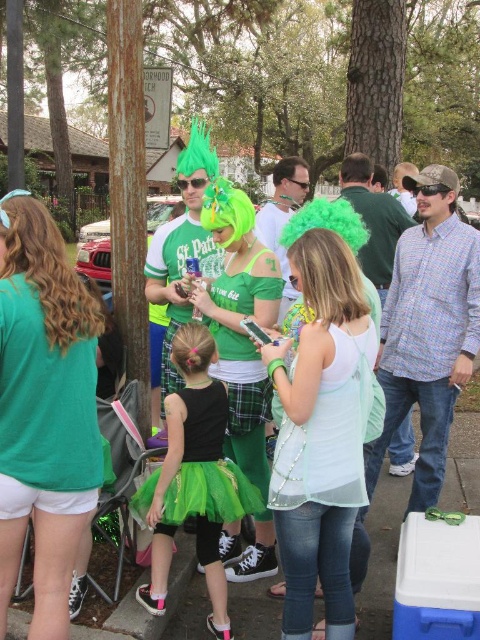
Is green tulle tutu at center behind matte green t-shirt at left?

Yes, green tulle tutu at center is further from the viewer.

Can you confirm if green tulle tutu at center is bigger than matte green t-shirt at left?

Yes.

What do you see at coordinates (193, 477) in the screenshot? I see `green tulle tutu at center` at bounding box center [193, 477].

Where is `green tulle tutu at center`? Image resolution: width=480 pixels, height=640 pixels. green tulle tutu at center is located at coordinates (193, 477).

Does green tulle tutu at center appear on the left side of mint sheer dress at center?

Yes, green tulle tutu at center is to the left of mint sheer dress at center.

Which is below, green tulle tutu at center or mint sheer dress at center?

green tulle tutu at center

Find the location of a particular element. The height and width of the screenshot is (640, 480). green tulle tutu at center is located at coordinates (193, 477).

Find the location of `green tulle tutu at center`. green tulle tutu at center is located at coordinates (193, 477).

Is light green mesh tank top at center bigger than green tulle skirt at center?

Correct, light green mesh tank top at center is larger in size than green tulle skirt at center.

Is light green mesh tank top at center smaller than green tulle skirt at center?

Actually, light green mesh tank top at center might be larger than green tulle skirt at center.

This screenshot has height=640, width=480. I want to click on light green mesh tank top at center, so click(x=323, y=432).